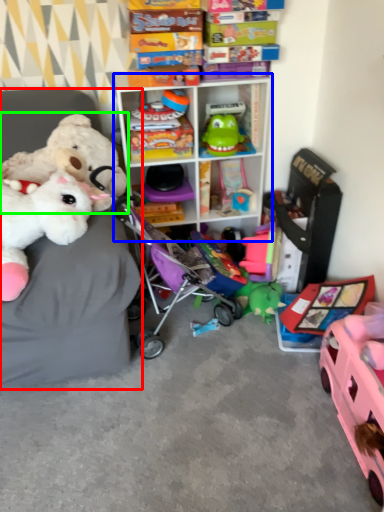
Question: Considering the real-world distances, which object is farthest from furniture (highlighted by a red box)? shelf (highlighted by a blue box) or toy (highlighted by a green box)?

Choices:
 (A) shelf
 (B) toy

Answer: (A)